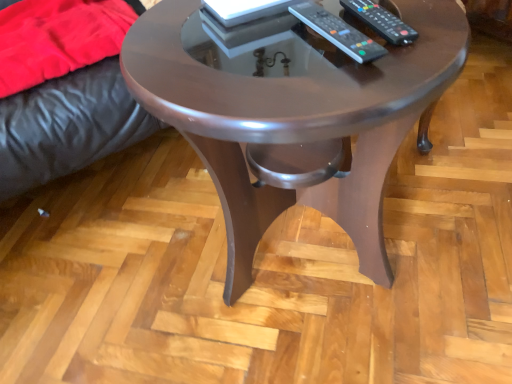
You are a GUI agent. You are given a task and a screenshot of the screen. Output one action in this format:
    pyautogui.click(x=<x>, y=<y>)
    Task: Click on the vacant space positioned to the left of black plastic remote at center, the first remote in the left-to-right sequence
    This screenshot has width=512, height=384.
    Given the screenshot: What is the action you would take?
    pyautogui.click(x=197, y=70)